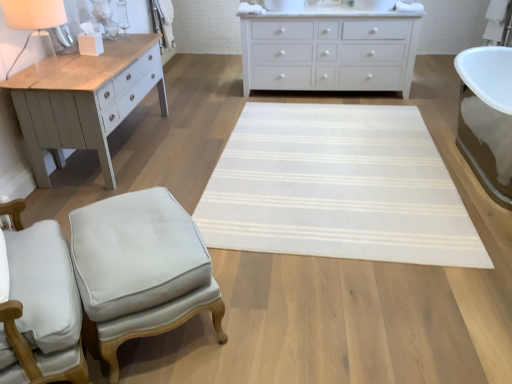
Locate an element on the screen. vacant space in front of white matte chest of drawers at upper center is located at coordinates [326, 140].